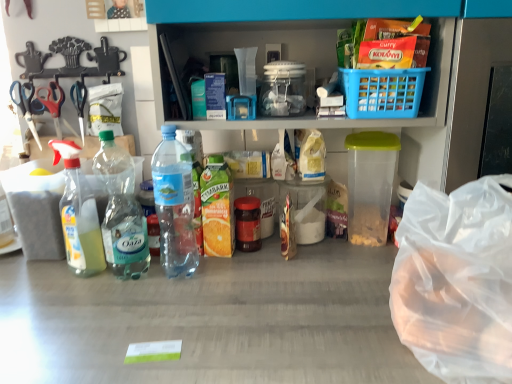
Describe the element at coordinates (457, 281) in the screenshot. I see `transparent plastic bag at lower right` at that location.

How much space does translucent plastic bottle at center, placed as the third bottle when sorted from left to right, occupy vertically?

translucent plastic bottle at center, placed as the third bottle when sorted from left to right, is 13.09 inches in height.

At what (x,y) coordinates should I click in order to perform the action: click on silver metallic scissors at left, the 3th scissors when ordered from left to right. Please return your answer as a coordinate pair (x, y). The width and height of the screenshot is (512, 384). Looking at the image, I should click on (79, 103).

What do you see at coordinates (78, 214) in the screenshot?
I see `clear plastic spray bottle at left, the 1th bottle in the left-to-right sequence` at bounding box center [78, 214].

Where is `clear plastic bottle at left, which is the second bottle from right to left`? clear plastic bottle at left, which is the second bottle from right to left is located at coordinates (121, 211).

Considering the positions of objects metallic scissors at left, acting as the first scissors starting from the left, and translucent plastic bottle at center, placed as the third bottle when sorted from left to right, in the image provided, who is behind, metallic scissors at left, acting as the first scissors starting from the left, or translucent plastic bottle at center, placed as the third bottle when sorted from left to right,?

metallic scissors at left, acting as the first scissors starting from the left, is behind.

Which object is wider, metallic scissors at left, the 3th scissors in the right-to-left sequence, or translucent plastic bottle at center, placed as the third bottle when sorted from left to right?

Wider between the two is translucent plastic bottle at center, placed as the third bottle when sorted from left to right.

Does metallic scissors at left, the 3th scissors in the right-to-left sequence, have a lesser height compared to translucent plastic bottle at center, placed as the third bottle when sorted from left to right?

Yes.

Which of these two, metallic scissors at left, acting as the first scissors starting from the left, or blue plastic basket at upper right, is smaller?

metallic scissors at left, acting as the first scissors starting from the left, is smaller.

Which scissors is the 3rd one when counting from the left side of the blue plastic basket at upper right? Please provide its 2D coordinates.

[(25, 105)]

Is metallic scissors at left, the 3th scissors in the right-to-left sequence, closer to camera compared to blue plastic basket at upper right?

No, it is behind blue plastic basket at upper right.

Considering their positions, is red plastic scissors at left, which is the 2th scissors from right to left, located in front of or behind blue plastic basket at upper right?

In the image, red plastic scissors at left, which is the 2th scissors from right to left, appears behind blue plastic basket at upper right.

From a real-world perspective, relative to blue plastic basket at upper right, is red plastic scissors at left, which is the 2th scissors from right to left, vertically above or below?

Clearly, from a real-world perspective, red plastic scissors at left, which is the 2th scissors from right to left, is below blue plastic basket at upper right.

Is red plastic scissors at left, which is the 2th scissors from right to left, bigger than blue plastic basket at upper right?

Actually, red plastic scissors at left, which is the 2th scissors from right to left, might be smaller than blue plastic basket at upper right.

From the image's perspective, which one is positioned higher, red plastic scissors at left, placed as the 2th scissors when sorted from left to right, or silver metallic scissors at left, positioned as the first scissors in right-to-left order?

From the image's view, silver metallic scissors at left, positioned as the first scissors in right-to-left order, is above.

How many degrees apart are the facing directions of red plastic scissors at left, which is the 2th scissors from right to left, and silver metallic scissors at left, positioned as the first scissors in right-to-left order?

They differ by 15.5 degrees in their facing directions.

Is red plastic scissors at left, placed as the 2th scissors when sorted from left to right, thinner than silver metallic scissors at left, the 3th scissors when ordered from left to right?

Incorrect, the width of red plastic scissors at left, placed as the 2th scissors when sorted from left to right, is not less than that of silver metallic scissors at left, the 3th scissors when ordered from left to right.

Is red plastic scissors at left, placed as the 2th scissors when sorted from left to right, facing away from silver metallic scissors at left, the 3th scissors when ordered from left to right?

That's not correct — red plastic scissors at left, placed as the 2th scissors when sorted from left to right, is not looking away from silver metallic scissors at left, the 3th scissors when ordered from left to right.

Does translucent plastic bottle at center, placed as the third bottle when sorted from left to right, have a greater height compared to blue plastic basket at upper right?

Yes, translucent plastic bottle at center, placed as the third bottle when sorted from left to right, is taller than blue plastic basket at upper right.

Is translucent plastic bottle at center, the first bottle viewed from the right, not close to blue plastic basket at upper right?

No.

Considering the points (177, 226) and (351, 109), which point is behind, point (177, 226) or point (351, 109)?

The point (177, 226) is farther from the camera.

How many degrees apart are the facing directions of red plastic scissors at left, which is the 2th scissors from right to left, and transparent plastic bag at lower right?

They differ by 7.87 degrees in their facing directions.

Measure the distance from red plastic scissors at left, which is the 2th scissors from right to left, to transparent plastic bag at lower right.

red plastic scissors at left, which is the 2th scissors from right to left, is 1.05 meters from transparent plastic bag at lower right.

Choose the correct answer: Is red plastic scissors at left, placed as the 2th scissors when sorted from left to right, inside transparent plastic bag at lower right or outside it?

red plastic scissors at left, placed as the 2th scissors when sorted from left to right, is outside transparent plastic bag at lower right.

Based on the photo, does red plastic scissors at left, which is the 2th scissors from right to left, have a greater height compared to transparent plastic bag at lower right?

Incorrect, the height of red plastic scissors at left, which is the 2th scissors from right to left, is not larger of that of transparent plastic bag at lower right.

Does point (19, 85) appear closer or farther from the camera than point (118, 163)?

Point (19, 85) appears to be closer to the viewer than point (118, 163).

From the image's perspective, which one is positioned lower, metallic scissors at left, acting as the first scissors starting from the left, or clear plastic bottle at left, which is the second bottle from right to left?

clear plastic bottle at left, which is the second bottle from right to left, from the image's perspective.

Can you confirm if metallic scissors at left, the 3th scissors in the right-to-left sequence, is positioned to the right of clear plastic bottle at left, which is the second bottle from right to left?

Incorrect, metallic scissors at left, the 3th scissors in the right-to-left sequence, is not on the right side of clear plastic bottle at left, which is the second bottle from right to left.

Measure the distance between metallic scissors at left, acting as the first scissors starting from the left, and clear plastic bottle at left, positioned as the second bottle in left-to-right order.

metallic scissors at left, acting as the first scissors starting from the left, is 13.86 inches from clear plastic bottle at left, positioned as the second bottle in left-to-right order.

From the image's perspective, starting from the metallic scissors at left, the 3th scissors in the right-to-left sequence, which bottle is the 1st one below? Please provide its 2D coordinates.

[(174, 205)]

This screenshot has height=384, width=512. Identify the location of scissors that is the 3rd one below the blue plastic basket at upper right (from a real-world perspective). (25, 105).

Considering their positions, is silver metallic scissors at left, positioned as the first scissors in right-to-left order, positioned closer to transparent plastic bag at lower right than clear plastic spray bottle at left, the 1th bottle in the left-to-right sequence?

clear plastic spray bottle at left, the 1th bottle in the left-to-right sequence, is closer to transparent plastic bag at lower right.

When comparing their distances from clear plastic spray bottle at left, the 1th bottle in the left-to-right sequence, does translucent plastic bottle at center, placed as the third bottle when sorted from left to right, or silver metallic scissors at left, the 3th scissors when ordered from left to right, seem closer?

translucent plastic bottle at center, placed as the third bottle when sorted from left to right, is positioned closer to the anchor clear plastic spray bottle at left, the 1th bottle in the left-to-right sequence.

Based on their spatial positions, is silver metallic scissors at left, the 3th scissors when ordered from left to right, or translucent plastic bottle at center, the first bottle viewed from the right, further from red plastic scissors at left, placed as the 2th scissors when sorted from left to right?

Among the two, translucent plastic bottle at center, the first bottle viewed from the right, is located further to red plastic scissors at left, placed as the 2th scissors when sorted from left to right.

Which object lies nearer to the anchor point clear plastic spray bottle at left, acting as the 3th bottle starting from the right, translucent plastic bottle at center, the first bottle viewed from the right, or clear plastic bottle at left, positioned as the second bottle in left-to-right order?

Based on the image, clear plastic bottle at left, positioned as the second bottle in left-to-right order, appears to be nearer to clear plastic spray bottle at left, acting as the 3th bottle starting from the right.

Looking at the image, which one is located further to clear plastic spray bottle at left, the 1th bottle in the left-to-right sequence, silver metallic scissors at left, the 3th scissors when ordered from left to right, or translucent plastic bottle at center, the first bottle viewed from the right?

silver metallic scissors at left, the 3th scissors when ordered from left to right, is positioned further to the anchor clear plastic spray bottle at left, the 1th bottle in the left-to-right sequence.

Looking at the image, which one is located closer to translucent plastic bottle at center, the first bottle viewed from the right, metallic scissors at left, acting as the first scissors starting from the left, or clear plastic spray bottle at left, acting as the 3th bottle starting from the right?

Based on the image, clear plastic spray bottle at left, acting as the 3th bottle starting from the right, appears to be nearer to translucent plastic bottle at center, the first bottle viewed from the right.

Which object lies nearer to the anchor point transparent plastic bag at lower right, translucent plastic bottle at center, the first bottle viewed from the right, or clear plastic bottle at left, positioned as the second bottle in left-to-right order?

translucent plastic bottle at center, the first bottle viewed from the right, is closer to transparent plastic bag at lower right.

Looking at the image, which one is located further to silver metallic scissors at left, the 3th scissors when ordered from left to right, clear plastic bottle at left, which is the second bottle from right to left, or clear plastic spray bottle at left, acting as the 3th bottle starting from the right?

clear plastic bottle at left, which is the second bottle from right to left, lies further to silver metallic scissors at left, the 3th scissors when ordered from left to right, than the other object.

Where is `scissors between red plastic scissors at left, placed as the 2th scissors when sorted from left to right, and translucent plastic bottle at center, placed as the third bottle when sorted from left to right, in the horizontal direction`? The width and height of the screenshot is (512, 384). scissors between red plastic scissors at left, placed as the 2th scissors when sorted from left to right, and translucent plastic bottle at center, placed as the third bottle when sorted from left to right, in the horizontal direction is located at coordinates (79, 103).

This screenshot has width=512, height=384. I want to click on scissors between clear plastic spray bottle at left, the 1th bottle in the left-to-right sequence, and red plastic scissors at left, which is the 2th scissors from right to left, from front to back, so click(25, 105).

This screenshot has width=512, height=384. In order to click on bottle located between clear plastic bottle at left, positioned as the second bottle in left-to-right order, and transparent plastic bag at lower right in the left-right direction in this screenshot , I will do 174,205.

This screenshot has height=384, width=512. I want to click on bottle located between clear plastic bottle at left, which is the second bottle from right to left, and red plastic scissors at left, placed as the 2th scissors when sorted from left to right, in the depth direction, so click(x=78, y=214).